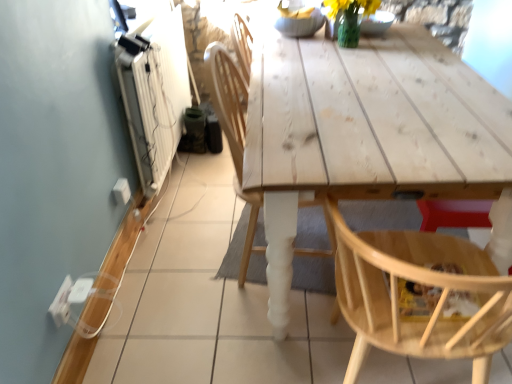
Question: Considering the positions of white plastic electric outlet at lower left, arranged as the 2th electric outlet when viewed from the front, and white plastic electric outlet at lower left, which is counted as the 1th electric outlet, starting from the left, in the image, is white plastic electric outlet at lower left, arranged as the 2th electric outlet when viewed from the front, wider or thinner than white plastic electric outlet at lower left, which is counted as the 1th electric outlet, starting from the left,?

Choices:
 (A) thin
 (B) wide

Answer: (B)

Question: From the image's perspective, is white plastic electric outlet at lower left, arranged as the 2th electric outlet when viewed from the front, positioned above or below white plastic electric outlet at lower left, placed as the first electric outlet when sorted from bottom to top?

Choices:
 (A) above
 (B) below

Answer: (A)

Question: Considering the real-world distances, which object is farthest from the white plastic electric outlet at lower left, placed as the first electric outlet when sorted from bottom to top?

Choices:
 (A) white plastic electric outlet at lower left, placed as the second electric outlet when sorted from bottom to top
 (B) natural wood chair at lower right, the second chair positioned from the left
 (C) wooden chair at center, acting as the 1th chair starting from the left

Answer: (B)

Question: Considering the real-world distances, which object is farthest from the white plastic electric outlet at lower left, placed as the second electric outlet when sorted from bottom to top?

Choices:
 (A) natural wood chair at lower right, placed as the 1th chair when sorted from right to left
 (B) wooden chair at center, the 2th chair when ordered from right to left
 (C) white plastic electric outlet at lower left, the second electric outlet positioned from the back

Answer: (A)